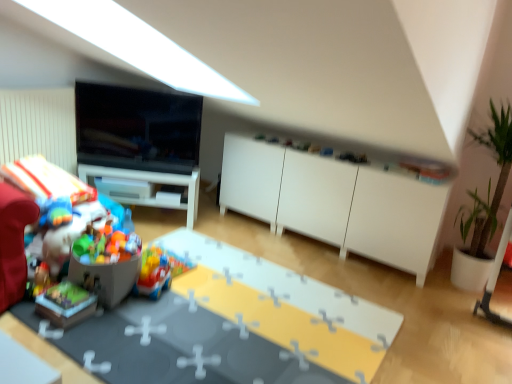
Locate an element on the screen. Image resolution: width=512 pixels, height=384 pixels. blank space situated above translucent plastic toy car at center, marked as the 4th toy in a left-to-right arrangement (from a real-world perspective) is located at coordinates (152, 253).